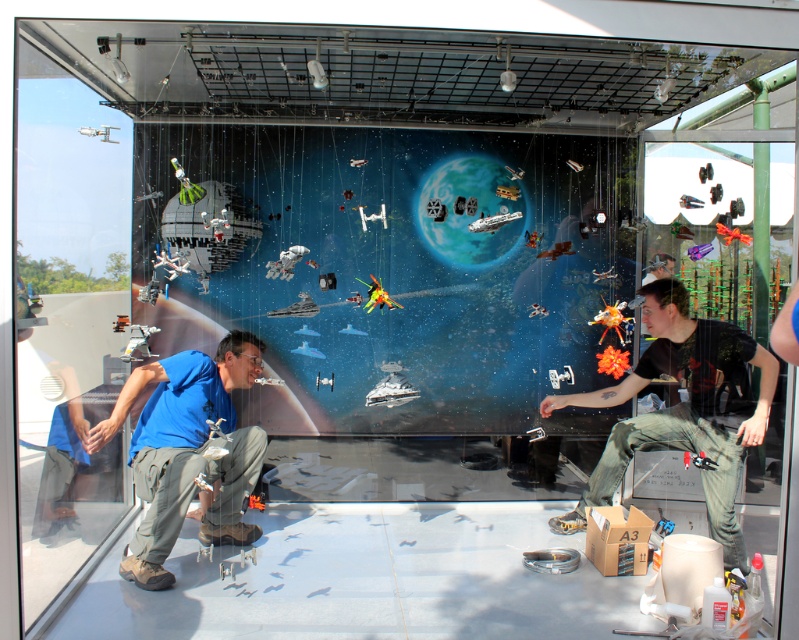
Is point (81, 516) behind point (213, 413)?

Yes, point (81, 516) is farther from viewer.

Is point (106, 316) less distant than point (161, 557)?

That is False.

Where is `transparent glass door at upper left`? transparent glass door at upper left is located at coordinates (66, 320).

Locate an element on the screen. The image size is (799, 640). transparent glass door at upper left is located at coordinates (66, 320).

Is point (221, 369) in front of point (652, 308)?

No, (221, 369) is further to viewer.

Which is behind, point (141, 548) or point (660, 333)?

Positioned behind is point (660, 333).

You are a GUI agent. You are given a task and a screenshot of the screen. Output one action in this format:
    pyautogui.click(x=<x>, y=<y>)
    Task: Click on the blue fabric shirt at lower left
    This screenshot has height=640, width=799.
    Given the screenshot: What is the action you would take?
    pyautogui.click(x=189, y=451)

Which is more to the right, transparent glass door at upper left or dark green pants at right?

dark green pants at right is more to the right.

Is transparent glass door at upper left bigger than dark green pants at right?

Indeed, transparent glass door at upper left has a larger size compared to dark green pants at right.

Does point (38, 483) lie behind point (631, 438)?

No.

Identify the location of transparent glass door at upper left. (66, 320).